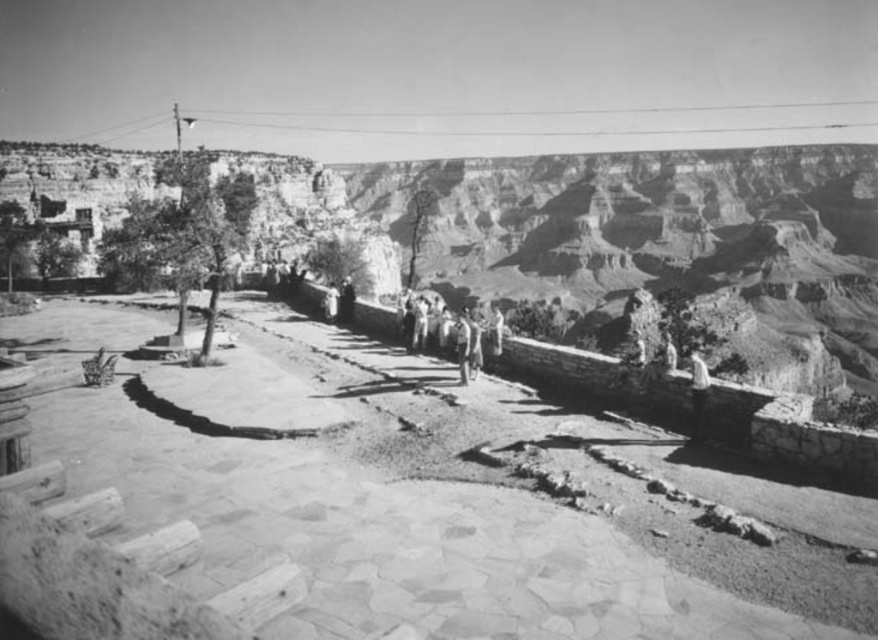
Is light gray fabric shirt at upper right wider than light beige stone person at center?

Incorrect, light gray fabric shirt at upper right's width does not surpass light beige stone person at center's.

This screenshot has height=640, width=878. What are the coordinates of `light gray fabric shirt at upper right` in the screenshot? It's located at (697, 394).

Identify the location of light gray fabric shirt at upper right. The height and width of the screenshot is (640, 878). 697,394.

Is light beige stone person at center wider than smooth skin person at center?

Indeed, light beige stone person at center has a greater width compared to smooth skin person at center.

Which is in front, point (673, 369) or point (332, 300)?

Point (673, 369)

You are a GUI agent. You are given a task and a screenshot of the screen. Output one action in this format:
    pyautogui.click(x=<x>, y=<y>)
    Task: Click on the light beige stone person at center
    Image resolution: width=878 pixels, height=640 pixels.
    Given the screenshot: What is the action you would take?
    click(x=668, y=353)

This screenshot has height=640, width=878. In order to click on light beige stone person at center in this screenshot , I will do `click(668, 353)`.

Is point (697, 356) less distant than point (325, 301)?

Yes, point (697, 356) is closer to viewer.

Is light gray fabric shirt at upper right shorter than smooth skin person at center?

No, light gray fabric shirt at upper right is not shorter than smooth skin person at center.

Which is in front, point (704, 372) or point (333, 291)?

Positioned in front is point (704, 372).

The image size is (878, 640). In order to click on light gray fabric shirt at upper right in this screenshot , I will do `click(697, 394)`.